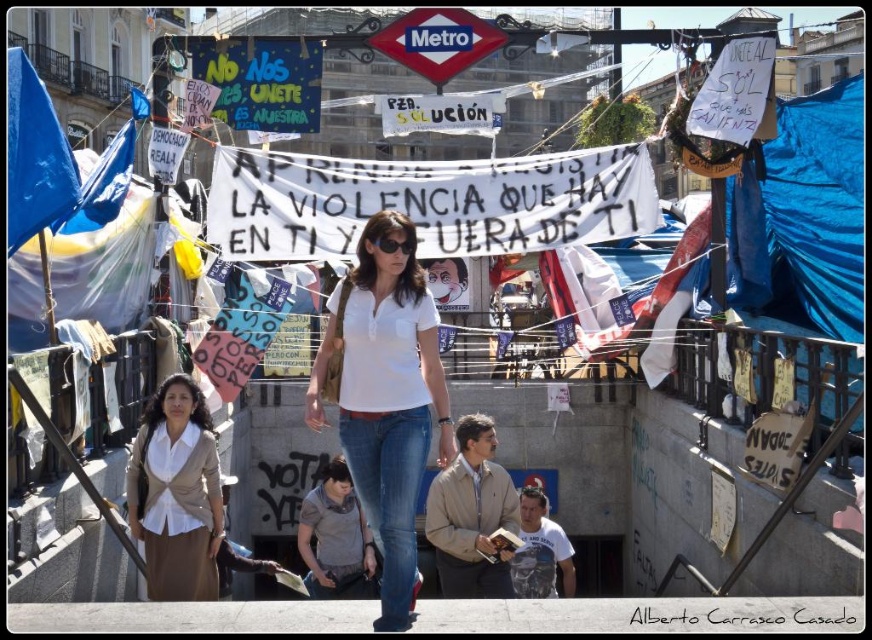
You are a delivery drone with a 1.2 meter wingspan. You need to fly from the beige fabric blouse at lower left to the denim jeans at center. Is there enough space between them for your drone to pass through?

The distance between the beige fabric blouse at lower left and the denim jeans at center is 12.50 meters, which is more than enough space for the drone with a 1.2 meter wingspan to pass through safely.

You are a fashion designer analyzing the urban scene. You notice the beige fabric blouse at lower left and the denim jeans at center. Which clothing item is positioned higher in the image?

The beige fabric blouse at lower left is positioned higher than the denim jeans at center in the image.